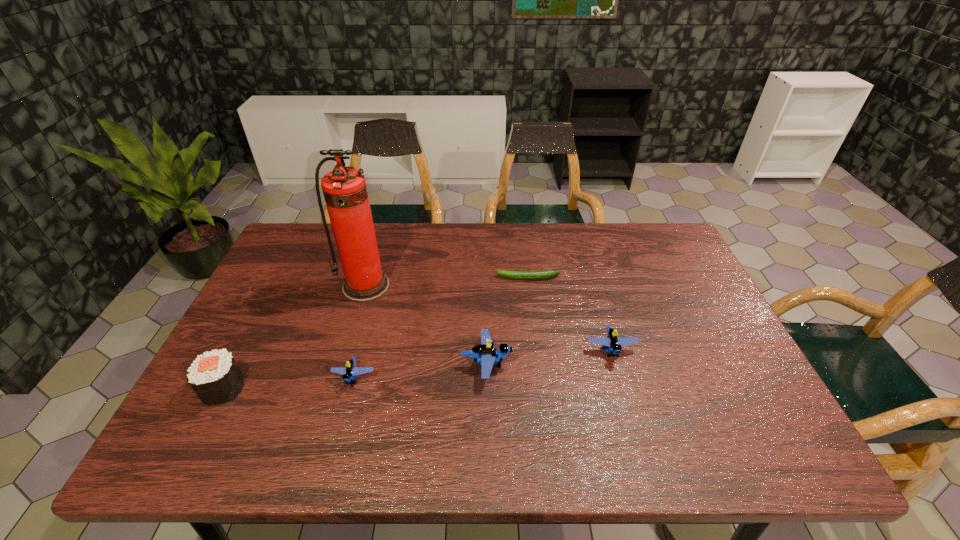
The height and width of the screenshot is (540, 960). Find the location of `blank space located 0.100m at the discharge end of the tallest object`. blank space located 0.100m at the discharge end of the tallest object is located at coordinates (353, 328).

Find the location of a particular element. vacant point located 0.110m on the front-facing side of the shortest object is located at coordinates (460, 278).

Locate an element on the screen. This screenshot has width=960, height=540. blank area located on the front-facing side of the shortest object is located at coordinates (406, 278).

Where is `vacant space situated 0.270m on the front-facing side of the shortest object`? vacant space situated 0.270m on the front-facing side of the shortest object is located at coordinates (406, 278).

The height and width of the screenshot is (540, 960). In order to click on blank space located on the right of the leftmost object in this screenshot , I will do pyautogui.click(x=380, y=388).

Find the location of a particular element. sushi that is at the near edge is located at coordinates (215, 377).

Locate an element on the screen. This screenshot has width=960, height=540. object that is positioned at the left edge is located at coordinates (215, 377).

The image size is (960, 540). Identify the location of object that is at the near left corner. (215, 377).

This screenshot has height=540, width=960. In the image, there is a desktop. Find the location of `free space at the far edge`. free space at the far edge is located at coordinates (600, 247).

The image size is (960, 540). Identify the location of vacant space at the near edge. coord(616,402).